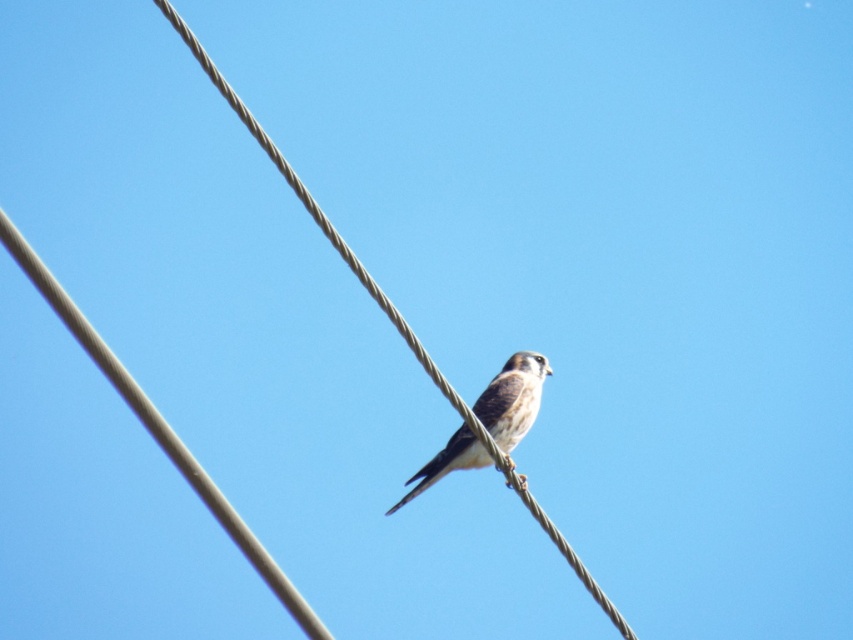
Question: In this image, where is gray wire at center located relative to brown speckled feathers at center?

Choices:
 (A) below
 (B) above

Answer: (B)

Question: Which of the following is the closest to the observer?

Choices:
 (A) (415, 492)
 (B) (552, 524)

Answer: (A)

Question: Which of the following is the farthest from the observer?

Choices:
 (A) gray wire at center
 (B) brown speckled feathers at center

Answer: (B)

Question: Which of the following is the closest to the observer?

Choices:
 (A) gray wire at center
 (B) brown speckled feathers at center

Answer: (A)

Question: Can you confirm if gray wire at center is positioned below brown speckled feathers at center?

Choices:
 (A) no
 (B) yes

Answer: (A)

Question: Is gray wire at center wider than brown speckled feathers at center?

Choices:
 (A) yes
 (B) no

Answer: (A)